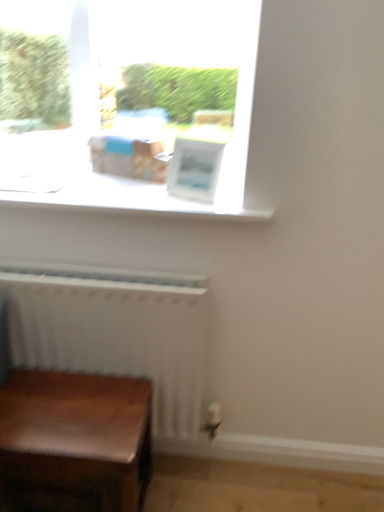
Question: Is wooden table at lower left further to the viewer compared to white matte radiator at lower left?

Choices:
 (A) no
 (B) yes

Answer: (A)

Question: Is wooden table at lower left with white matte radiator at lower left?

Choices:
 (A) no
 (B) yes

Answer: (A)

Question: Does wooden table at lower left appear on the right side of white matte radiator at lower left?

Choices:
 (A) yes
 (B) no

Answer: (B)

Question: Considering the relative sizes of wooden table at lower left and white matte radiator at lower left in the image provided, is wooden table at lower left bigger than white matte radiator at lower left?

Choices:
 (A) no
 (B) yes

Answer: (A)

Question: Is wooden table at lower left surrounding white matte radiator at lower left?

Choices:
 (A) no
 (B) yes

Answer: (A)

Question: From the image's perspective, is white matte radiator at lower left positioned above or below wooden table at lower left?

Choices:
 (A) below
 (B) above

Answer: (B)

Question: Is white matte radiator at lower left in front of or behind wooden table at lower left in the image?

Choices:
 (A) front
 (B) behind

Answer: (B)

Question: Considering the positions of white matte radiator at lower left and wooden table at lower left in the image, is white matte radiator at lower left taller or shorter than wooden table at lower left?

Choices:
 (A) short
 (B) tall

Answer: (B)

Question: In the image, is white matte radiator at lower left on the left side or the right side of wooden table at lower left?

Choices:
 (A) right
 (B) left

Answer: (A)

Question: From a real-world perspective, relative to white matte radiator at lower left, is wooden table at lower left vertically above or below?

Choices:
 (A) below
 (B) above

Answer: (A)

Question: Is point (66, 461) positioned closer to the camera than point (91, 358)?

Choices:
 (A) closer
 (B) farther

Answer: (A)

Question: Is wooden table at lower left inside or outside of white matte radiator at lower left?

Choices:
 (A) outside
 (B) inside

Answer: (A)

Question: Would you say wooden table at lower left is to the left or to the right of white matte radiator at lower left in the picture?

Choices:
 (A) right
 (B) left

Answer: (B)

Question: Relative to white matte radiator at lower left, is white matte window sill at upper center in front or behind?

Choices:
 (A) behind
 (B) front

Answer: (B)

Question: Is white matte window sill at upper center inside the boundaries of white matte radiator at lower left, or outside?

Choices:
 (A) inside
 (B) outside

Answer: (B)